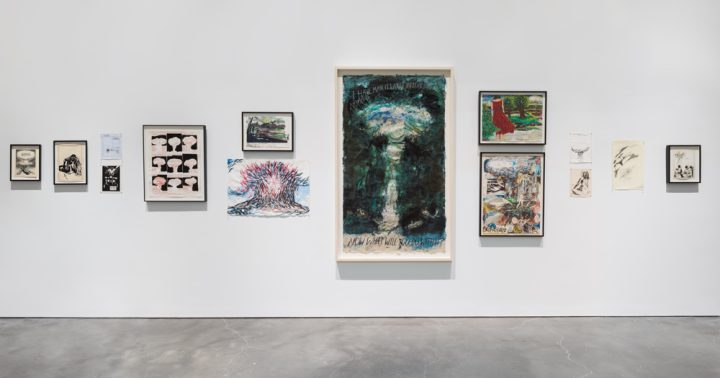
Find the location of a particular element. This screenshot has width=720, height=378. floor is located at coordinates [x=312, y=364].